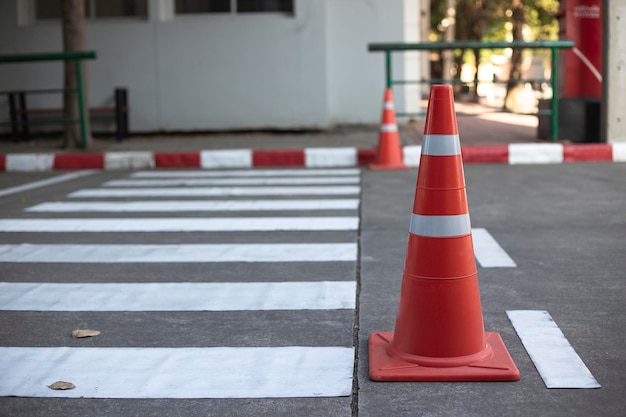
Where is `orange painted stripes`? This screenshot has width=626, height=417. orange painted stripes is located at coordinates (77, 158), (172, 158), (279, 158), (371, 153), (485, 151), (577, 148).